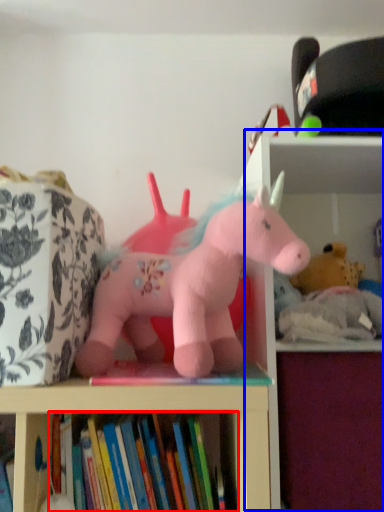
Question: Which of the following is the closest to the observer, book (highlighted by a red box) or bookshelf (highlighted by a blue box)?

Choices:
 (A) book
 (B) bookshelf

Answer: (A)